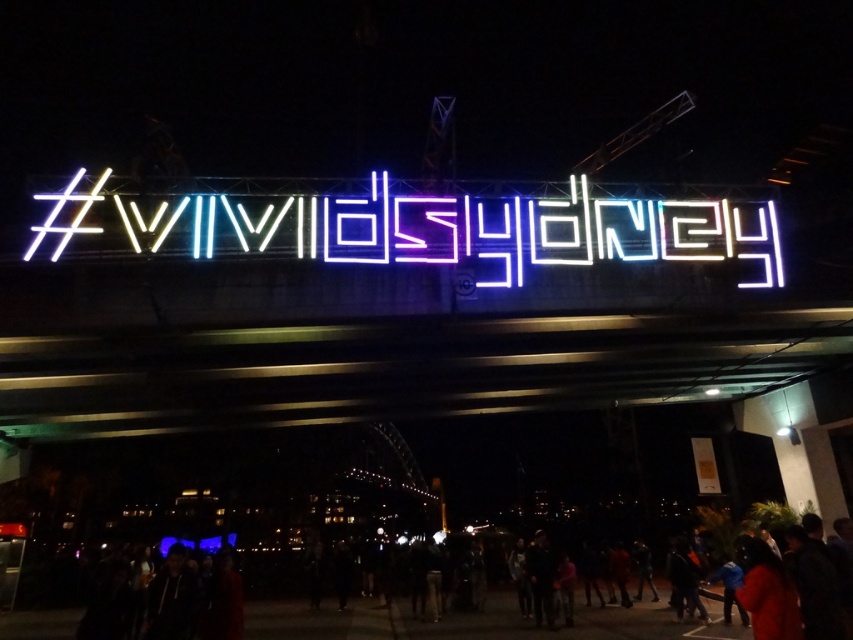
Is neontextsign at center behind black jacket at lower center?

Yes, neontextsign at center is behind black jacket at lower center.

Where is `neontextsign at center`? The width and height of the screenshot is (853, 640). neontextsign at center is located at coordinates (408, 227).